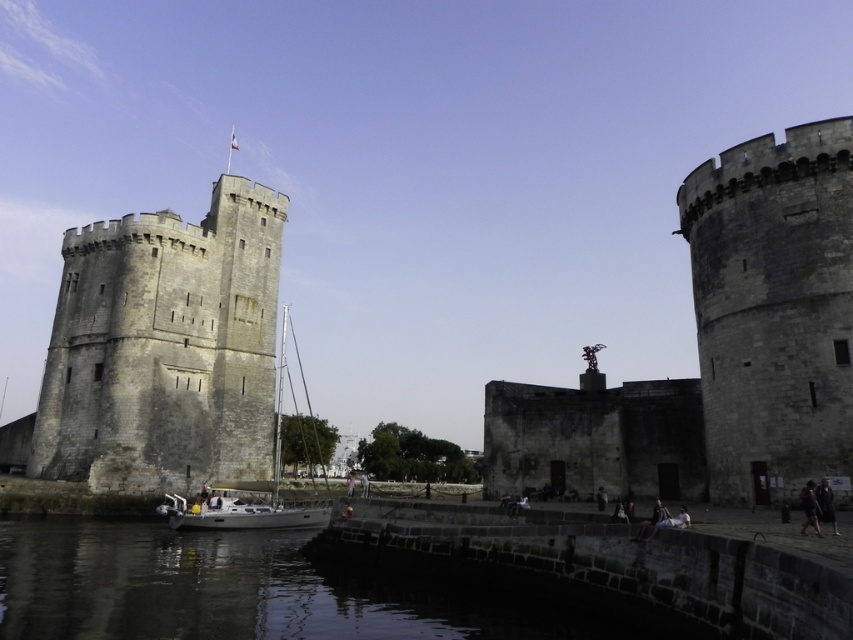
You are a photographer planning to capture the gray stone tower at left and the dark brown leather jacket at lower right in a single frame. Based on their positions, which object is positioned closer to the center of the image?

The gray stone tower at left is positioned closer to the center of the image than the dark brown leather jacket at lower right.

You are a tour guide explaining the historic waterfront to a group. You mention the gray stone tower at left and the circular tower on the right. How far apart are these two towers?

The gray stone tower at left and the circular tower on the right are 229.00 feet apart.